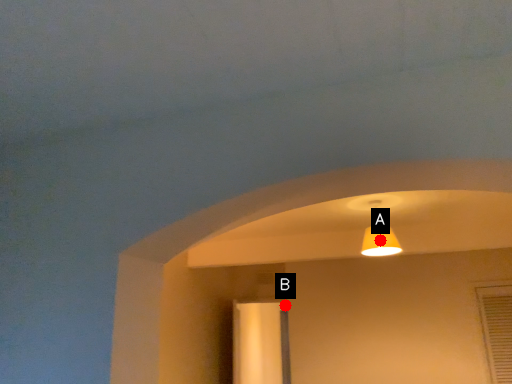
Question: Two points are circled on the image, labeled by A and B beside each circle. Which point is farther to the camera?

Choices:
 (A) A is further
 (B) B is further

Answer: (B)